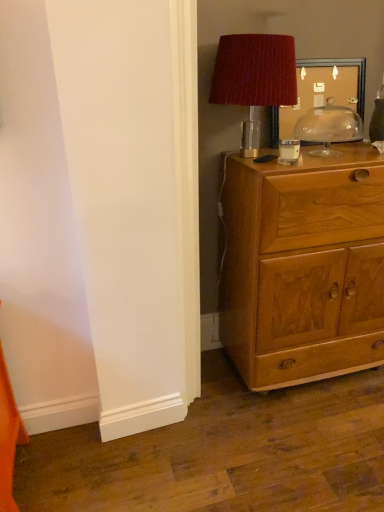
Find the location of a particular element. The width and height of the screenshot is (384, 512). blank space situated above wooden cabinet at right (from a real-world perspective) is located at coordinates (327, 150).